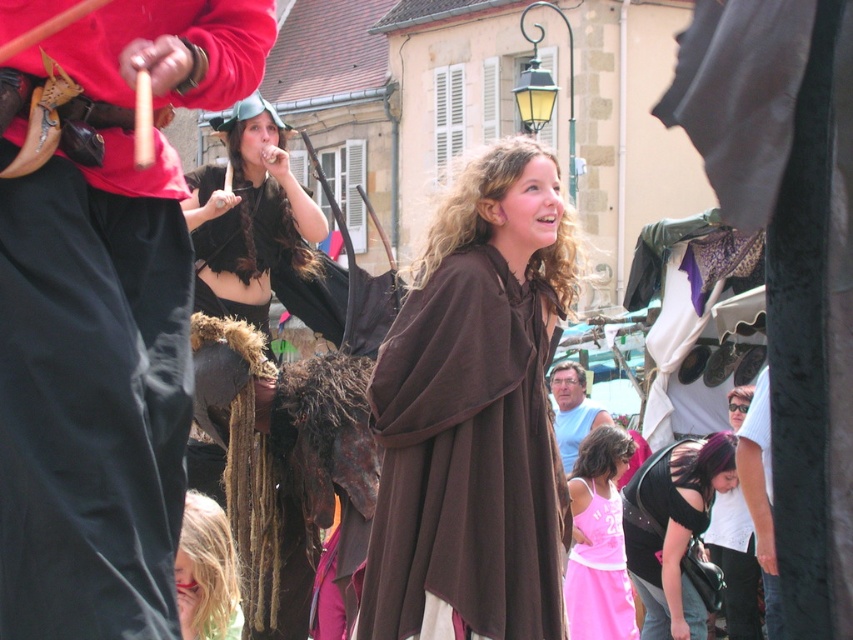
Question: Estimate the real-world distances between objects in this image. Which object is closer to the white cotton shirt at lower right?

Choices:
 (A) brown soft fabric cape at center
 (B) pink cotton dress at center
 (C) matte black pants at left

Answer: (B)

Question: Considering the relative positions of brown soft fabric cape at center and white cotton shirt at lower right in the image provided, where is brown soft fabric cape at center located with respect to white cotton shirt at lower right?

Choices:
 (A) below
 (B) above

Answer: (B)

Question: Which point appears closest to the camera in this image?

Choices:
 (A) (759, 586)
 (B) (664, 456)
 (C) (164, 579)

Answer: (C)

Question: Which object is positioned farthest from the blonde hair at lower left?

Choices:
 (A) brown soft fabric cape at center
 (B) matte black pants at left
 (C) light blue cotton shirt at center
 (D) pink cotton dress at center

Answer: (C)

Question: Does matte black pants at left lie in front of white cotton shirt at lower right?

Choices:
 (A) yes
 (B) no

Answer: (A)

Question: Where is black leather purse at lower right located in relation to pink cotton dress at center in the image?

Choices:
 (A) below
 (B) above

Answer: (A)